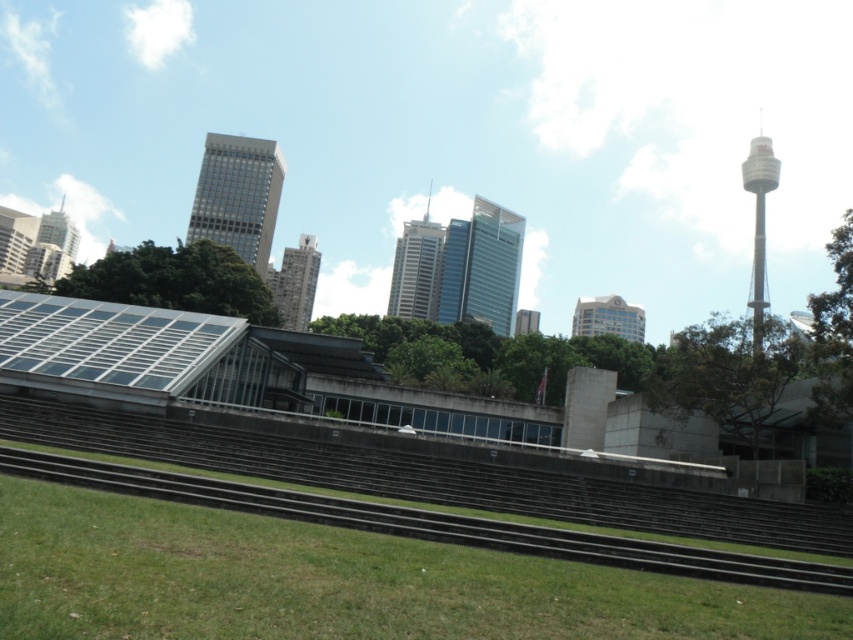
Which of these two, greenish metallic tower at right or smooth glass skyscraper at center, stands taller?

Standing taller between the two is greenish metallic tower at right.

Does greenish metallic tower at right appear on the left side of smooth glass skyscraper at center?

Incorrect, greenish metallic tower at right is not on the left side of smooth glass skyscraper at center.

Does point (758, 296) lie in front of point (277, 275)?

Yes.

Identify the location of greenish metallic tower at right. (759, 221).

Between green grass at lower center and smooth glass skyscraper at center, which one is positioned higher?

Positioned higher is smooth glass skyscraper at center.

Where is `green grass at lower center`? This screenshot has height=640, width=853. green grass at lower center is located at coordinates (335, 580).

Does glassy reflective skyscraper at upper center have a lesser height compared to matte glass skyscraper at upper left?

Indeed, glassy reflective skyscraper at upper center has a lesser height compared to matte glass skyscraper at upper left.

Between glassy reflective skyscraper at upper center and matte glass skyscraper at upper left, which one appears on the right side from the viewer's perspective?

glassy reflective skyscraper at upper center

Is point (267, 205) less distant than point (4, 278)?

That is False.

Find the location of `glassy reflective skyscraper at upper center`. glassy reflective skyscraper at upper center is located at coordinates (238, 195).